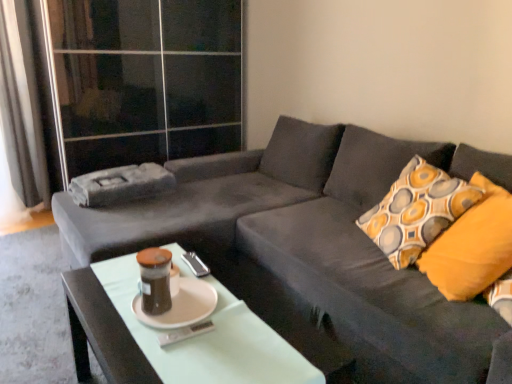
Find the location of a particular element. free space in front of white matte saucer at center is located at coordinates (168, 351).